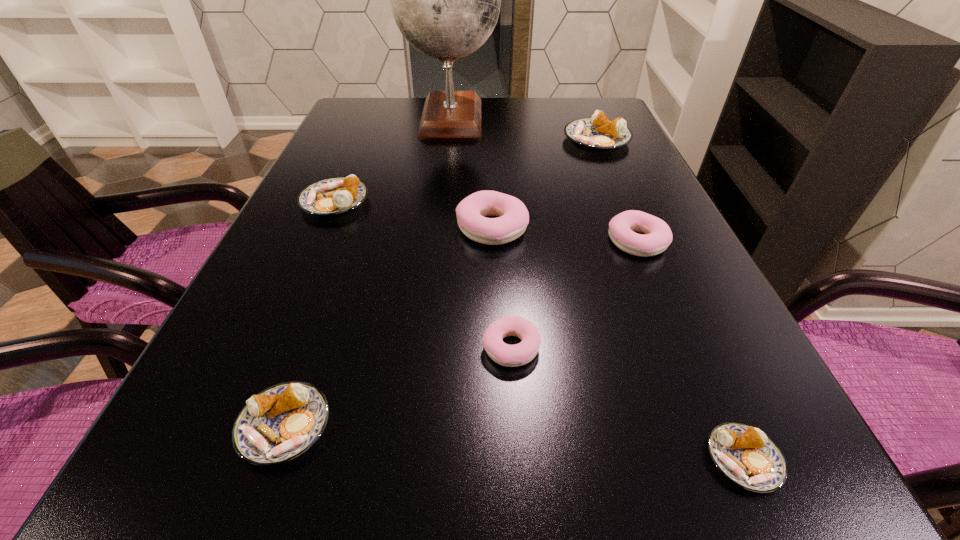
Find the location of a particular element. Image resolution: width=960 pixels, height=540 pixels. free space between the rightmost pink pastry and the third biggest brown pastry is located at coordinates (461, 334).

Locate an element on the screen. vacant space in between the third nearest brown pastry and the biggest brown pastry is located at coordinates (466, 171).

Image resolution: width=960 pixels, height=540 pixels. What are the coordinates of `vacant space in between the biggest pink pastry and the second biggest pink pastry` in the screenshot? It's located at (564, 235).

Locate an element on the screen. The width and height of the screenshot is (960, 540). vacant space that is in between the second biggest pink pastry and the smallest pink pastry is located at coordinates (574, 295).

Image resolution: width=960 pixels, height=540 pixels. In order to click on empty space between the second biggest pink pastry and the smallest pink pastry in this screenshot , I will do `click(574, 295)`.

I want to click on free space between the second farthest brown pastry and the tallest object, so click(393, 159).

Where is `free area in between the second farthest brown pastry and the biggest brown pastry`? The width and height of the screenshot is (960, 540). free area in between the second farthest brown pastry and the biggest brown pastry is located at coordinates (466, 171).

Select which object is the sixth closest to the rightmost pink pastry. Please provide its 2D coordinates. Your answer should be formatted as a tuple, i.e. [(x, y)], where the tuple contains the x and y coordinates of a point satisfying the conditions above.

[(336, 195)]

Choose which object is the second nearest neighbor to the third nearest pastry. Please provide its 2D coordinates. Your answer should be formatted as a tuple, i.e. [(x, y)], where the tuple contains the x and y coordinates of a point satisfying the conditions above.

[(282, 422)]

Select which pastry is the fifth closest to the rightmost pink pastry. Please provide its 2D coordinates. Your answer should be formatted as a tuple, i.e. [(x, y)], where the tuple contains the x and y coordinates of a point satisfying the conditions above.

[(336, 195)]